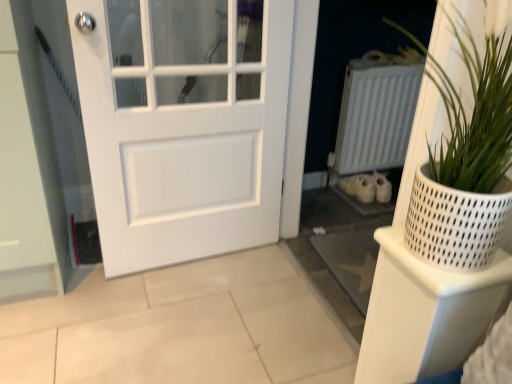
Question: Does point (444, 288) appear closer or farther from the camera than point (329, 157)?

Choices:
 (A) closer
 (B) farther

Answer: (A)

Question: In the image, is white plastic shelf at right positioned in front of or behind white matte radiator at center right?

Choices:
 (A) behind
 (B) front

Answer: (B)

Question: Which is nearer to the white matte door at center?

Choices:
 (A) white textured pot at right
 (B) white plastic shelf at right
 (C) white matte radiator at center right

Answer: (C)

Question: Which of these objects is positioned closest to the white matte radiator at center right?

Choices:
 (A) white plastic shelf at right
 (B) white matte door at center
 (C) white textured pot at right

Answer: (B)